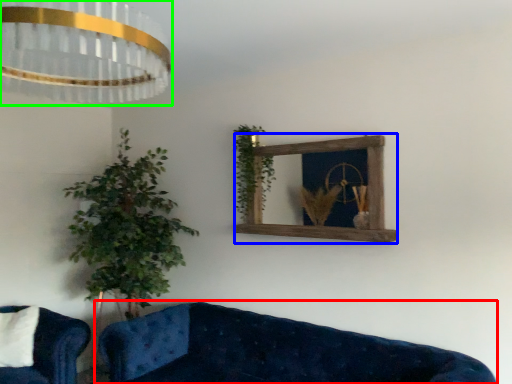
Question: Considering the real-world distances, which object is farthest from studio couch (highlighted by a red box)? window frame (highlighted by a blue box) or lamp (highlighted by a green box)?

Choices:
 (A) window frame
 (B) lamp

Answer: (B)